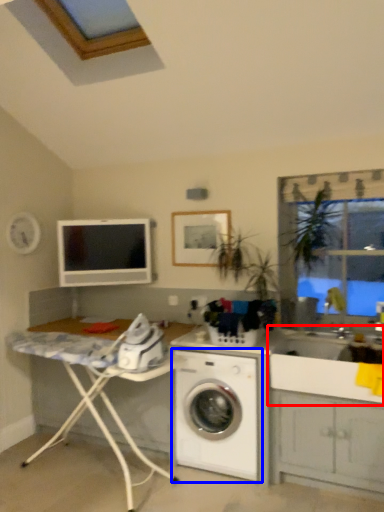
Question: Which object appears closest to the camera in this image, sink (highlighted by a red box) or washing machine (highlighted by a blue box)?

Choices:
 (A) sink
 (B) washing machine

Answer: (A)